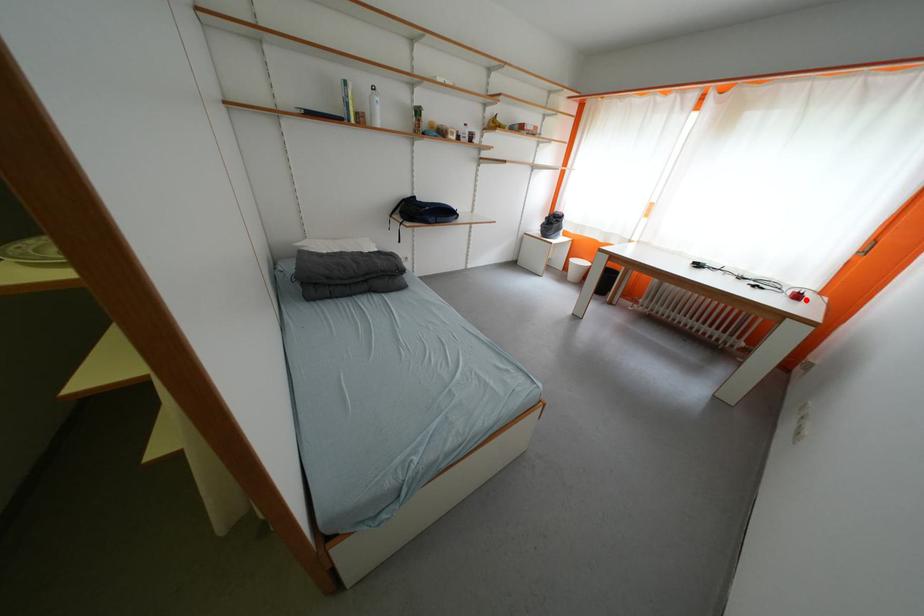
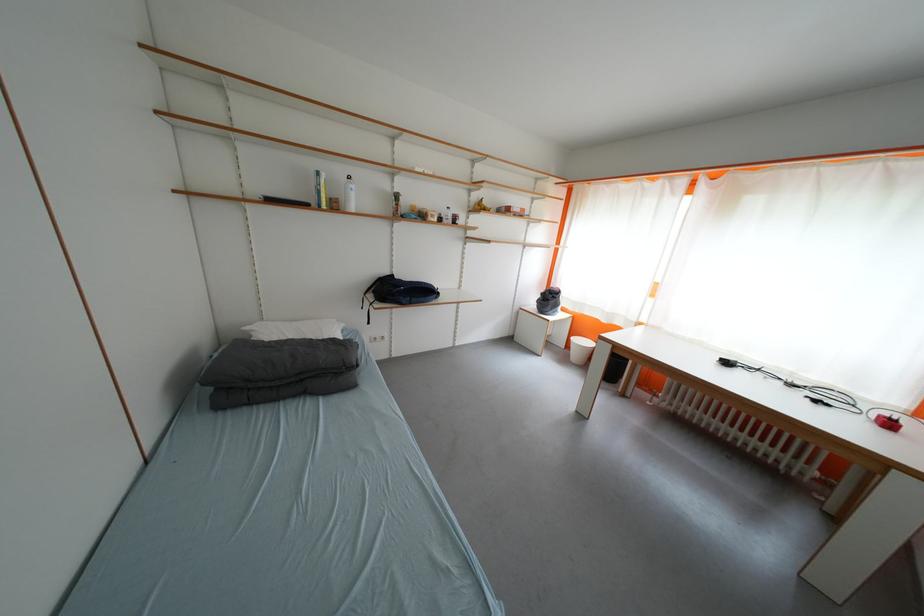
Locate, in the second image, the point that corresponds to the highlighted location in the first image.

(897, 428)